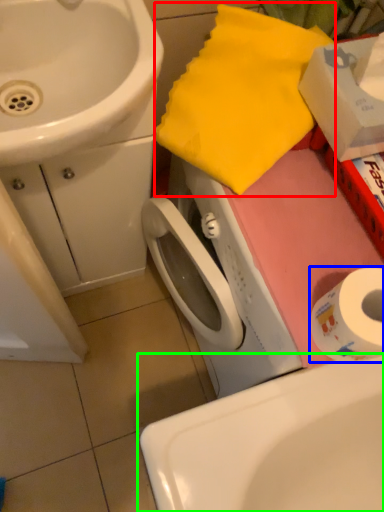
Question: Which object is the closest to the beach towel (highlighted by a red box)? Choose among these: toilet paper (highlighted by a blue box) or sink (highlighted by a green box).

Choices:
 (A) toilet paper
 (B) sink

Answer: (A)